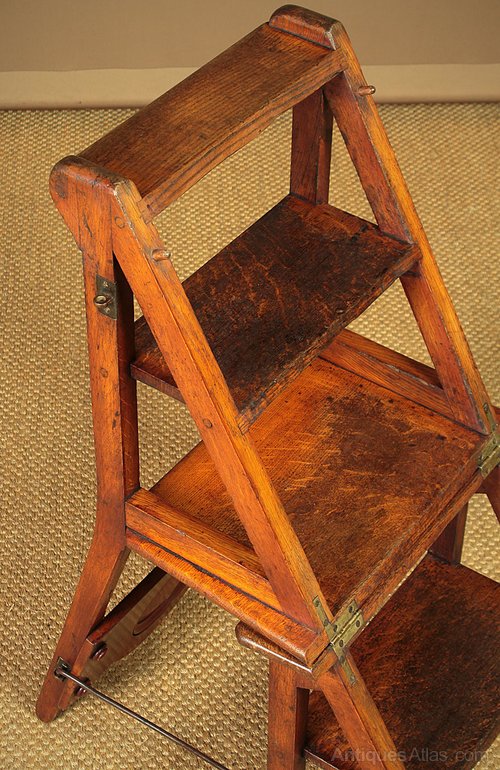
Locate an element on the screen. Image resolution: width=500 pixels, height=770 pixels. stairs is located at coordinates (273, 77).